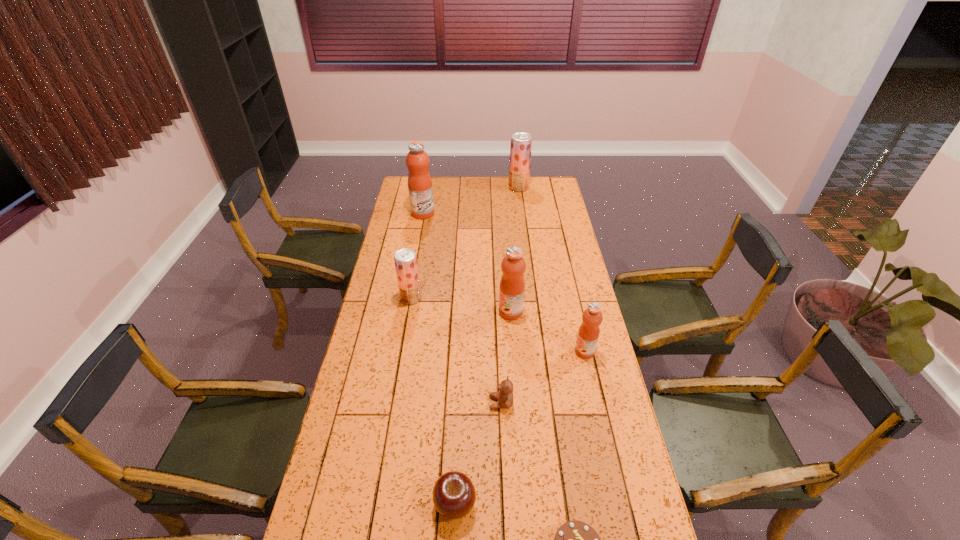
The width and height of the screenshot is (960, 540). Find the location of `vacant point at the left edge`. vacant point at the left edge is located at coordinates (399, 366).

In the image, there is a desktop. Where is `free space at the right edge`? free space at the right edge is located at coordinates (618, 429).

The width and height of the screenshot is (960, 540). Identify the location of free spot at the far right corner of the desktop. (535, 191).

Image resolution: width=960 pixels, height=540 pixels. What are the coordinates of `vacant point located between the rightmost orange fruit juice and the farthest fruit juice` in the screenshot? It's located at (551, 269).

Identify the location of free space between the red apple and the brown teddy bear. Image resolution: width=960 pixels, height=540 pixels. (478, 454).

The height and width of the screenshot is (540, 960). I want to click on free space between the second nearest object and the right strawberry fruit juice, so coord(487,346).

In order to click on vacant area that lies between the farthest orange fruit juice and the red apple in this screenshot , I will do `click(439, 359)`.

I want to click on vacant point located between the nearest fruit juice and the nearer strawberry fruit juice, so click(x=497, y=325).

Find the location of a particular element. The height and width of the screenshot is (540, 960). vacant space that's between the nearer strawberry fruit juice and the second smallest orange fruit juice is located at coordinates [461, 305].

I want to click on vacant point located between the farther strawberry fruit juice and the rightmost fruit juice, so click(x=551, y=269).